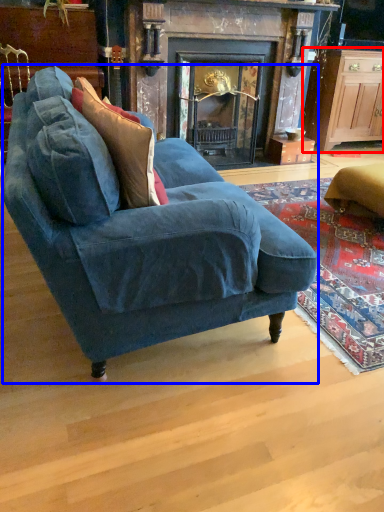
Question: Which object appears farthest to the camera in this image, cabinetry (highlighted by a red box) or studio couch (highlighted by a blue box)?

Choices:
 (A) cabinetry
 (B) studio couch

Answer: (A)